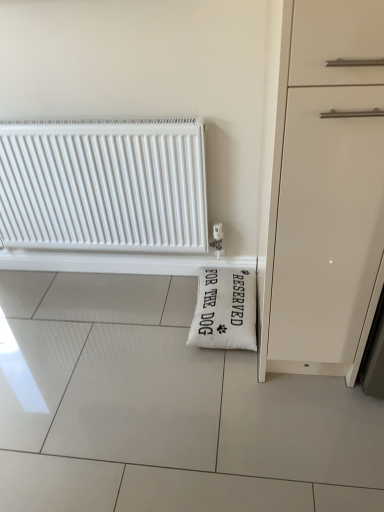
Question: Should I look upward or downward to see white plastic radiator at upper left?

Choices:
 (A) up
 (B) down

Answer: (A)

Question: Is white plastic radiator at upper left outside of white fabric pillow at lower right?

Choices:
 (A) no
 (B) yes

Answer: (B)

Question: Considering the relative sizes of white plastic radiator at upper left and white fabric pillow at lower right in the image provided, is white plastic radiator at upper left thinner than white fabric pillow at lower right?

Choices:
 (A) no
 (B) yes

Answer: (B)

Question: From the image's perspective, would you say white plastic radiator at upper left is shown under white fabric pillow at lower right?

Choices:
 (A) yes
 (B) no

Answer: (B)

Question: Is white fabric pillow at lower right located within white plastic radiator at upper left?

Choices:
 (A) no
 (B) yes

Answer: (A)

Question: Can you confirm if white plastic radiator at upper left is positioned to the left of white fabric pillow at lower right?

Choices:
 (A) yes
 (B) no

Answer: (A)

Question: Considering the relative sizes of white plastic radiator at upper left and white fabric pillow at lower right in the image provided, is white plastic radiator at upper left taller than white fabric pillow at lower right?

Choices:
 (A) yes
 (B) no

Answer: (A)

Question: From a real-world perspective, is white fabric pillow at lower right on top of white plastic radiator at upper left?

Choices:
 (A) no
 (B) yes

Answer: (A)

Question: Is white fabric pillow at lower right in front of white plastic radiator at upper left?

Choices:
 (A) no
 (B) yes

Answer: (A)

Question: Can you confirm if white fabric pillow at lower right is taller than white plastic radiator at upper left?

Choices:
 (A) no
 (B) yes

Answer: (A)

Question: Is white fabric pillow at lower right looking in the opposite direction of white plastic radiator at upper left?

Choices:
 (A) yes
 (B) no

Answer: (B)

Question: Does white fabric pillow at lower right have a lesser width compared to white plastic radiator at upper left?

Choices:
 (A) no
 (B) yes

Answer: (A)

Question: Does white fabric pillow at lower right have a greater width compared to white plastic radiator at upper left?

Choices:
 (A) no
 (B) yes

Answer: (B)

Question: From a real-world perspective, is white plastic radiator at upper left above or below white fabric pillow at lower right?

Choices:
 (A) below
 (B) above

Answer: (B)